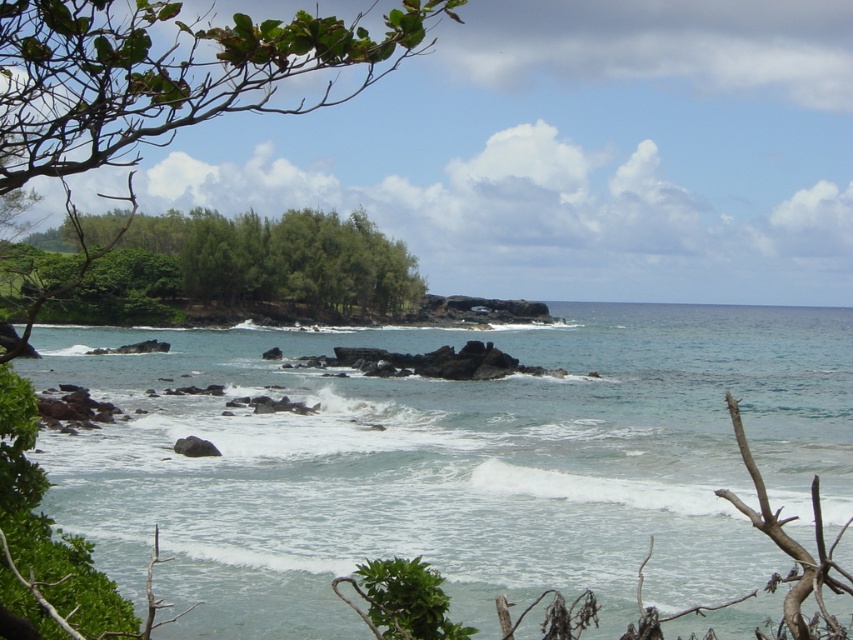
You are standing at the edge of the coastal scene and want to determine which object is closer to you between the clear blue water at center and the green leafy trees at center. Based on their positions, which one is nearer?

The clear blue water at center is shorter than green leafy trees at center, so the clear blue water at center is nearer to you.

You are standing at the point closest to the viewer in the coastal scene. Which point are you at, point (608, 384) or point (68, 33)?

You are at point (68, 33) because it is closer to the viewer than point (608, 384), which is behind it.

You are standing at the camera position in the coastal scene. There is a point marked at coordinates point (614, 500). Can you reach this point without moving closer than 20 meters from your current position?

The point (614, 500) is 19.61 meters away from the camera, which is less than 20 meters. Therefore, you cannot reach it without moving closer than 20 meters.